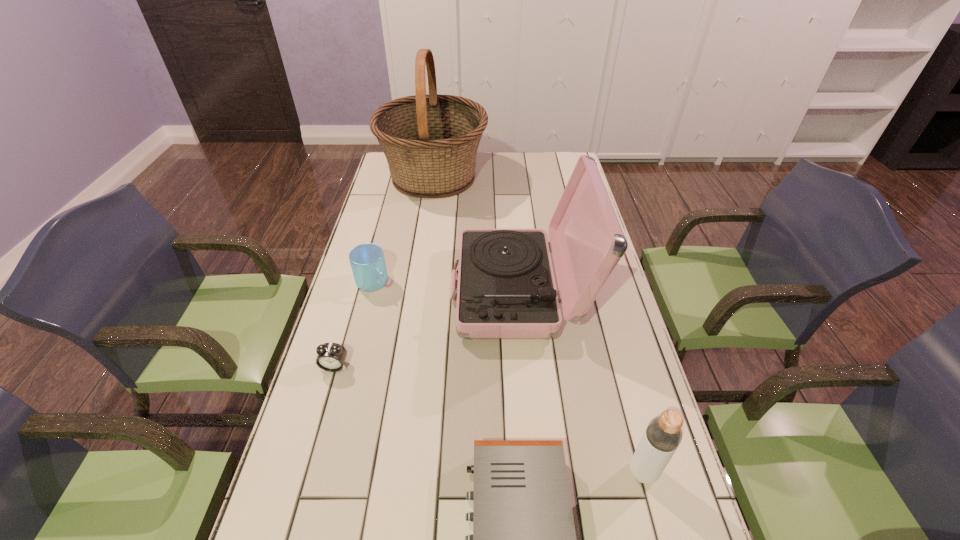
I want to click on free space at the left edge, so click(314, 450).

At what (x,y) coordinates should I click in order to perform the action: click on vacant region between the alarm clock and the bottle. Please return your answer as a coordinate pair (x, y). Image resolution: width=960 pixels, height=540 pixels. Looking at the image, I should click on (489, 419).

The image size is (960, 540). I want to click on free area in between the third nearest object and the record player, so click(427, 328).

In order to click on vacant area between the fourth farthest object and the third tallest object in this screenshot , I will do `click(489, 419)`.

Identify which object is the third closest to the basket. Please provide its 2D coordinates. Your answer should be formatted as a tuple, i.e. [(x, y)], where the tuple contains the x and y coordinates of a point satisfying the conditions above.

[(331, 356)]

Locate which object is the third closest to the third nearest object. Please provide its 2D coordinates. Your answer should be formatted as a tuple, i.e. [(x, y)], where the tuple contains the x and y coordinates of a point satisfying the conditions above.

[(524, 539)]